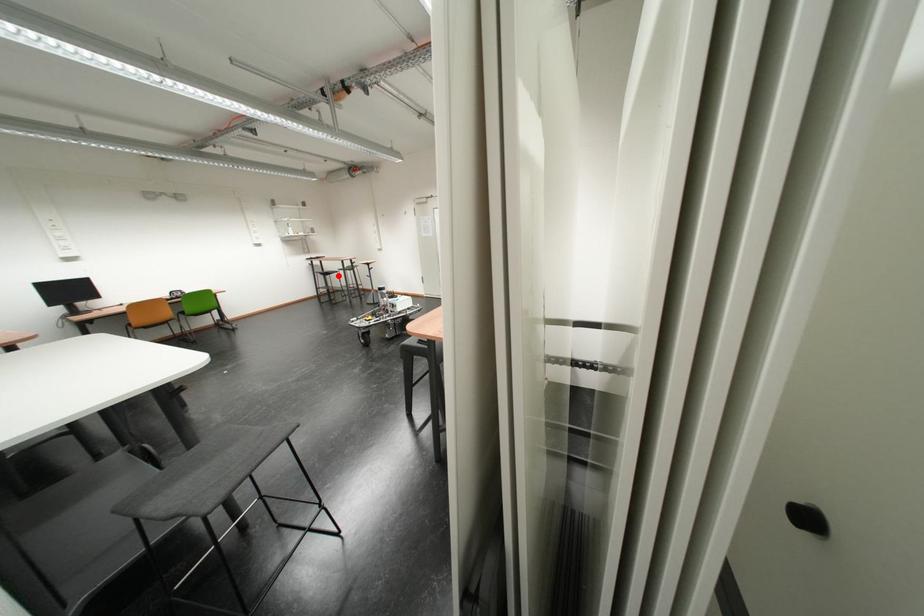
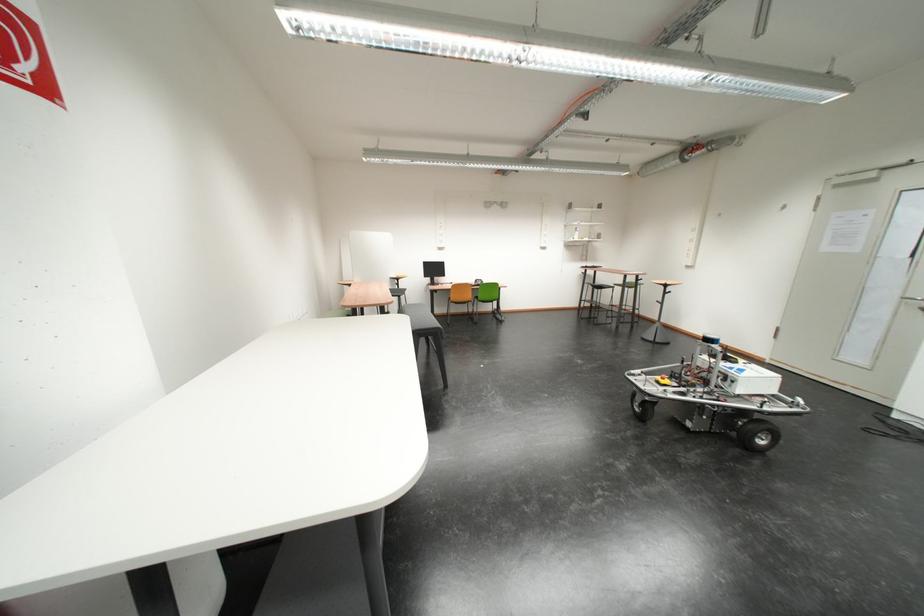
The point at the highlighted location is marked in the first image. Where is the corresponding point in the second image?

(612, 290)